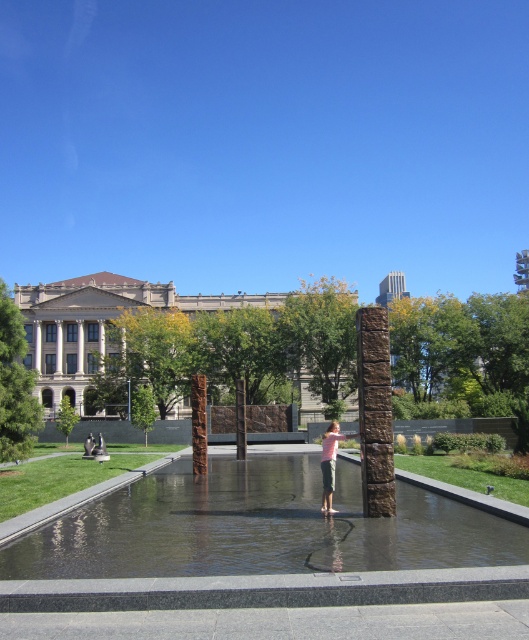
Question: Does clear glass water at center have a greater width compared to pink cotton shirt at center?

Choices:
 (A) no
 (B) yes

Answer: (B)

Question: Which point appears farthest from the camera in this image?

Choices:
 (A) (302, 484)
 (B) (322, 458)

Answer: (B)

Question: Does clear glass water at center appear on the right side of pink cotton shirt at center?

Choices:
 (A) yes
 (B) no

Answer: (B)

Question: Which point is closer to the camera?

Choices:
 (A) clear glass water at center
 (B) pink cotton shirt at center

Answer: (A)

Question: Where is clear glass water at center located in relation to pink cotton shirt at center in the image?

Choices:
 (A) below
 (B) above

Answer: (B)